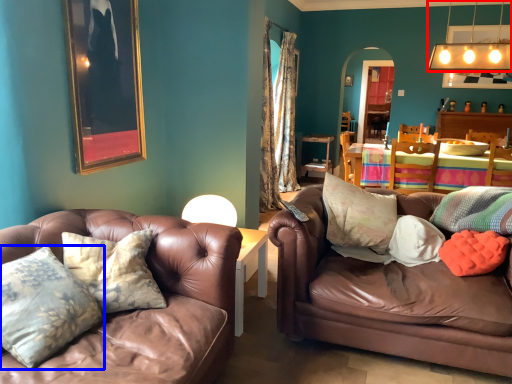
Question: Which object is closer to the camera taking this photo, lamp (highlighted by a red box) or pillow (highlighted by a blue box)?

Choices:
 (A) lamp
 (B) pillow

Answer: (B)